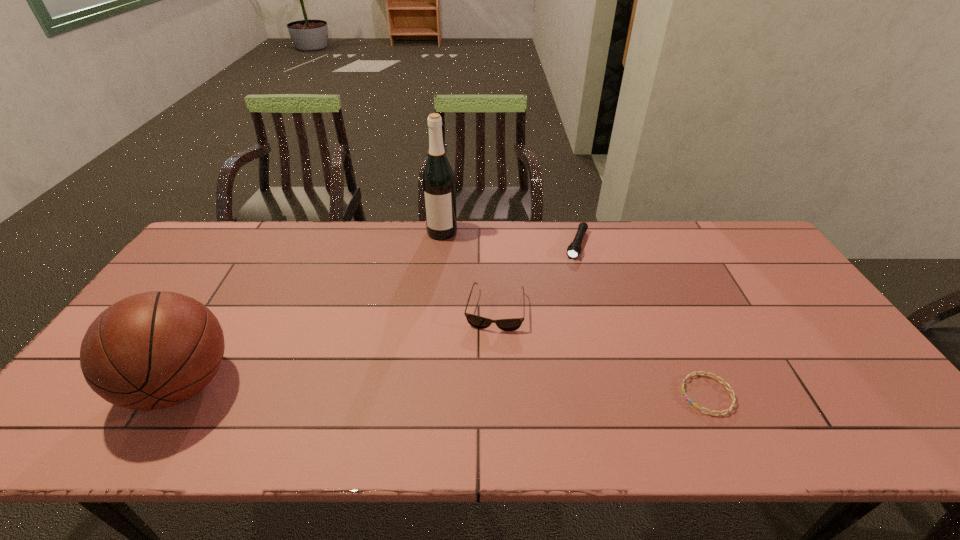
This screenshot has width=960, height=540. I want to click on free point located on the lenses of the third object from left to right, so (485, 377).

The height and width of the screenshot is (540, 960). I want to click on free spot located 0.230m on the lenses of the third object from left to right, so click(x=481, y=405).

Locate an element on the screen. wine bottle that is at the far edge is located at coordinates (438, 181).

The width and height of the screenshot is (960, 540). Find the location of `flashlight located in the far edge section of the desktop`. flashlight located in the far edge section of the desktop is located at coordinates (574, 249).

The image size is (960, 540). Identify the location of basketball that is at the near edge. (153, 350).

Identify the location of bracelet that is at the near edge. (731, 391).

I want to click on object that is at the left edge, so click(153, 350).

You are a GUI agent. You are given a task and a screenshot of the screen. Output one action in this format:
    pyautogui.click(x=<x>, y=<y>)
    Task: Click on the object situated at the near left corner
    
    Given the screenshot: What is the action you would take?
    pyautogui.click(x=153, y=350)

The height and width of the screenshot is (540, 960). Identify the location of vacant space at the far edge. (569, 228).

You are a GUI agent. You are given a task and a screenshot of the screen. Output one action in this format:
    pyautogui.click(x=<x>, y=<y>)
    Task: Click on the free space at the near edge of the desktop
    
    Given the screenshot: What is the action you would take?
    (x=455, y=391)